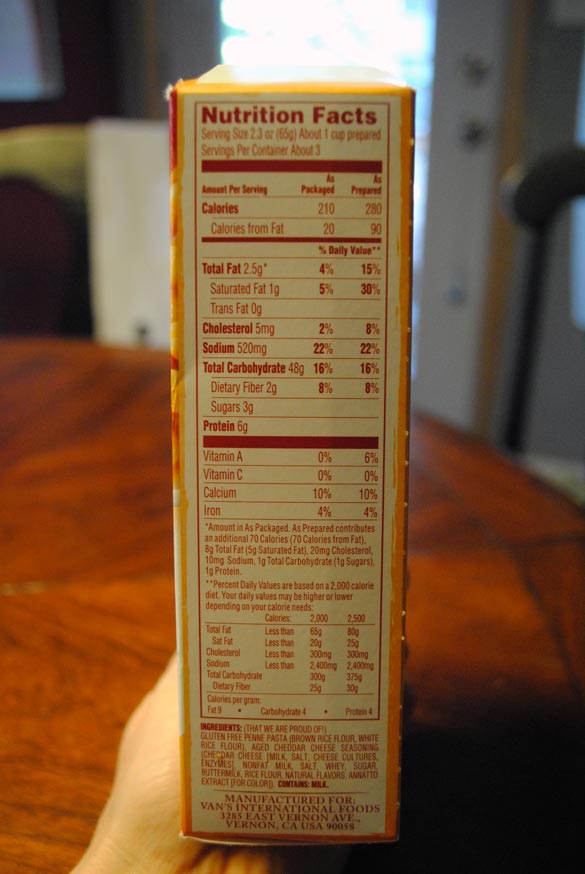
Locate an element on the screen. dark shadow on table is located at coordinates (524, 791).